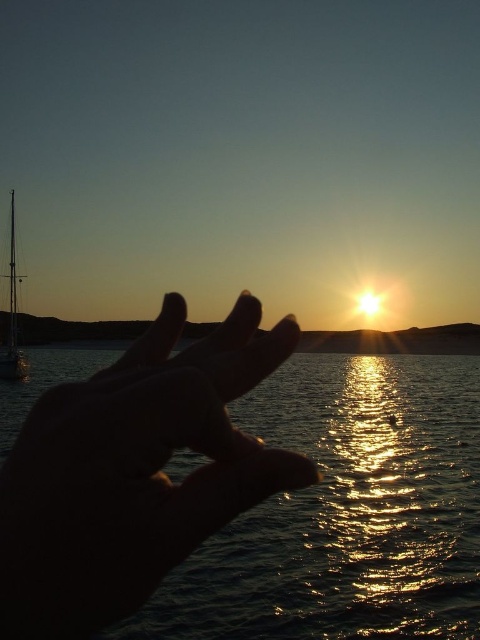
Is point (129, 611) more distant than point (385, 346)?

No, (129, 611) is closer to viewer.

Does silky skin hand at center have a lesser width compared to smooth sand horizon at center?

Yes, silky skin hand at center is thinner than smooth sand horizon at center.

Is point (228, 324) behind point (478, 332)?

No.

Find the location of a particular element. The height and width of the screenshot is (640, 480). silky skin hand at center is located at coordinates (133, 474).

Is smooth sand horizon at center thinner than shiny metallic sailboat at left?

Incorrect, smooth sand horizon at center's width is not less than shiny metallic sailboat at left's.

The width and height of the screenshot is (480, 640). Identify the location of smooth sand horizon at center. (396, 340).

Between silky skin hand at center and shiny metallic sailboat at left, which one has more height?

With more height is shiny metallic sailboat at left.

Does silky skin hand at center have a larger size compared to shiny metallic sailboat at left?

Incorrect, silky skin hand at center is not larger than shiny metallic sailboat at left.

Where is `silky skin hand at center`? The width and height of the screenshot is (480, 640). silky skin hand at center is located at coordinates (133, 474).